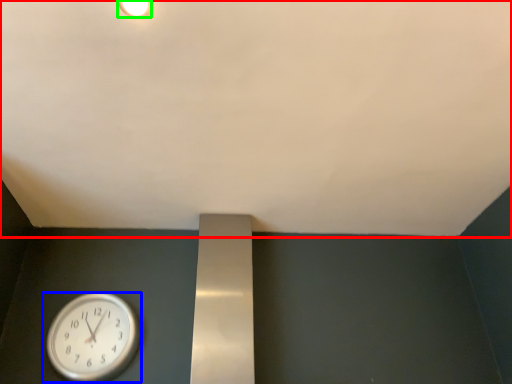
Question: Which object is positioned closest to backdrop (highlighted by a red box)? Select from wall clock (highlighted by a blue box) and light fixture (highlighted by a green box).

Choices:
 (A) wall clock
 (B) light fixture

Answer: (B)